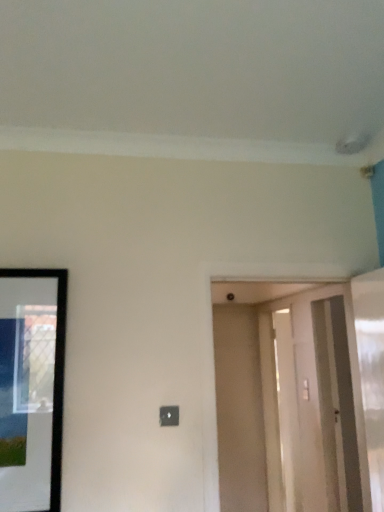
Question: Is smooth beige door at center thinner than black glossy picture frame at left?

Choices:
 (A) yes
 (B) no

Answer: (B)

Question: Is black glossy picture frame at left at the back of smooth beige door at center?

Choices:
 (A) yes
 (B) no

Answer: (B)

Question: From a real-world perspective, does smooth beige door at center stand above black glossy picture frame at left?

Choices:
 (A) no
 (B) yes

Answer: (A)

Question: Is smooth beige door at center taller than black glossy picture frame at left?

Choices:
 (A) no
 (B) yes

Answer: (B)

Question: Is smooth beige door at center not within black glossy picture frame at left?

Choices:
 (A) yes
 (B) no

Answer: (A)

Question: From the image's perspective, is smooth beige door at center beneath black glossy picture frame at left?

Choices:
 (A) yes
 (B) no

Answer: (A)

Question: Is clear glass screen door at right wider than smooth beige door at center?

Choices:
 (A) no
 (B) yes

Answer: (B)

Question: Can you confirm if clear glass screen door at right is smaller than smooth beige door at center?

Choices:
 (A) yes
 (B) no

Answer: (B)

Question: Can you confirm if clear glass screen door at right is positioned to the right of smooth beige door at center?

Choices:
 (A) no
 (B) yes

Answer: (B)

Question: Is smooth beige door at center inside clear glass screen door at right?

Choices:
 (A) no
 (B) yes

Answer: (A)

Question: Does clear glass screen door at right appear on the left side of smooth beige door at center?

Choices:
 (A) yes
 (B) no

Answer: (B)

Question: Is clear glass screen door at right positioned far away from smooth beige door at center?

Choices:
 (A) no
 (B) yes

Answer: (B)

Question: Is smooth beige door at center not inside clear glass screen door at right?

Choices:
 (A) no
 (B) yes

Answer: (B)